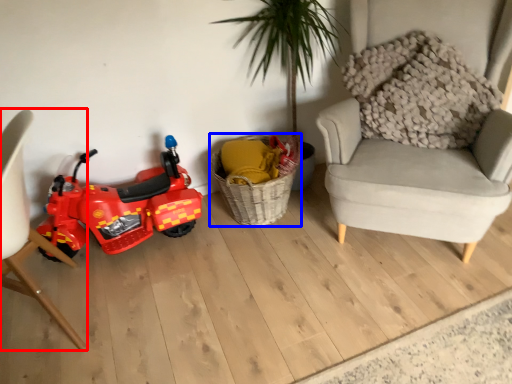
Question: Which point is closer to the camera, chair (highlighted by a red box) or basket (highlighted by a blue box)?

Choices:
 (A) chair
 (B) basket

Answer: (A)